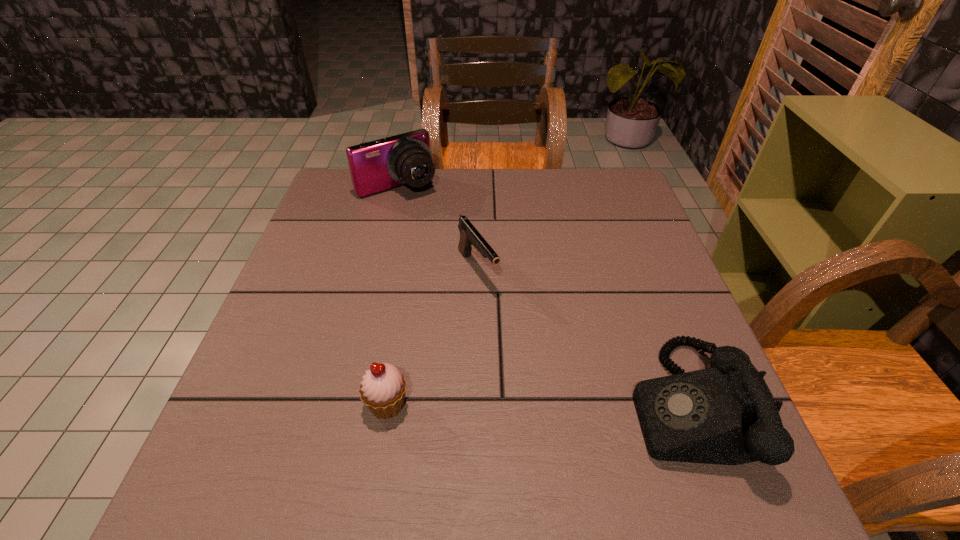
Where is `vacant spot on the desktop that is between the cupcake and the telephone and is positioned at the muzzle of the second object from right to left`? vacant spot on the desktop that is between the cupcake and the telephone and is positioned at the muzzle of the second object from right to left is located at coordinates (579, 404).

This screenshot has width=960, height=540. I want to click on vacant space on the desktop that is between the cupcake and the telephone and is positioned on the front-facing side of the farthest object, so click(572, 404).